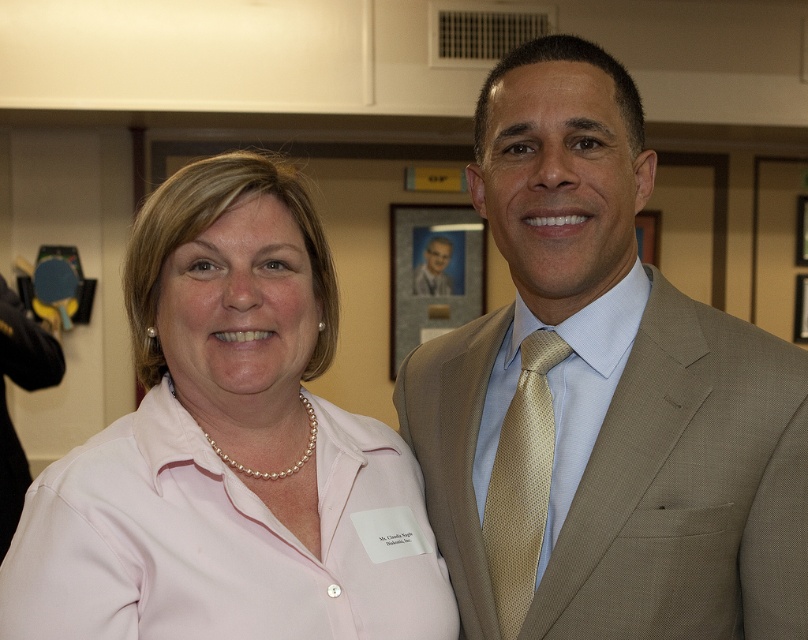
Question: Is tan textured suit at center further to camera compared to pink satin blouse at center?

Choices:
 (A) no
 (B) yes

Answer: (B)

Question: Which object is closer to the camera taking this photo?

Choices:
 (A) light blue shirt at center
 (B) pink satin blouse at center
 (C) tan textured suit at center

Answer: (B)

Question: Based on their relative distances, which object is nearer to the pink satin blouse at center?

Choices:
 (A) light blue shirt at center
 (B) tan textured suit at center
 (C) gold textured tie at right

Answer: (B)

Question: Can you confirm if tan textured suit at center is positioned to the right of pink satin blouse at center?

Choices:
 (A) yes
 (B) no

Answer: (A)

Question: Does tan textured suit at center appear over pink satin blouse at center?

Choices:
 (A) yes
 (B) no

Answer: (A)

Question: Estimate the real-world distances between objects in this image. Which object is farther from the pink satin blouse at center?

Choices:
 (A) tan textured suit at center
 (B) gold textured tie at right

Answer: (B)